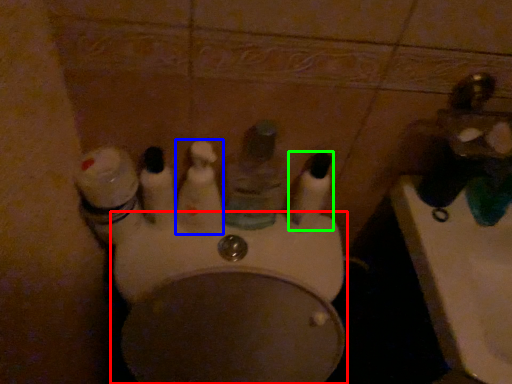
Question: Based on their relative distances, which object is farther from toilet (highlighted by a red box)? Choose from mouthwash (highlighted by a blue box) and mouthwash (highlighted by a green box).

Choices:
 (A) mouthwash
 (B) mouthwash

Answer: (B)